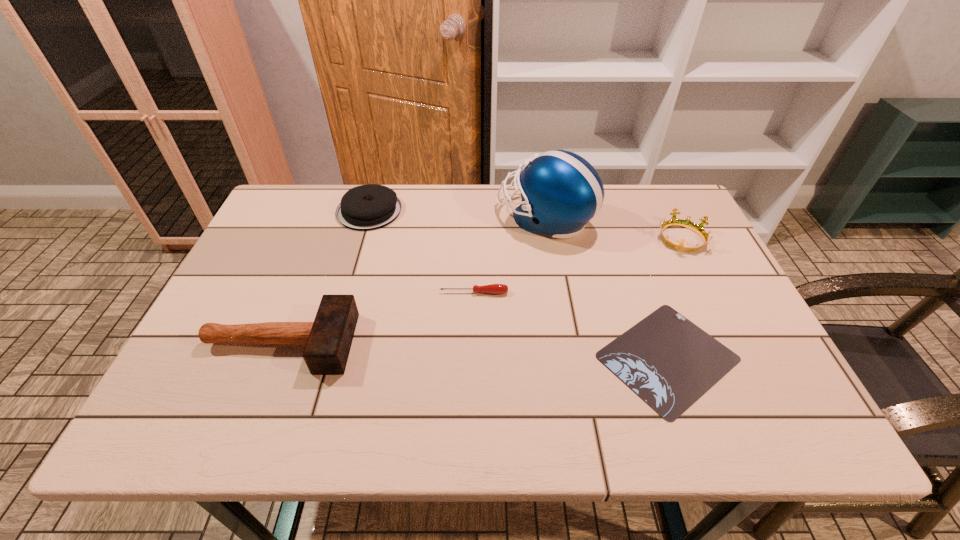
Where is `free space that satisfies the following two spatial constraints: 1. at the front of the shortest object with the faceguard; 2. on the right side of the tallest object`? The height and width of the screenshot is (540, 960). free space that satisfies the following two spatial constraints: 1. at the front of the shortest object with the faceguard; 2. on the right side of the tallest object is located at coordinates (568, 357).